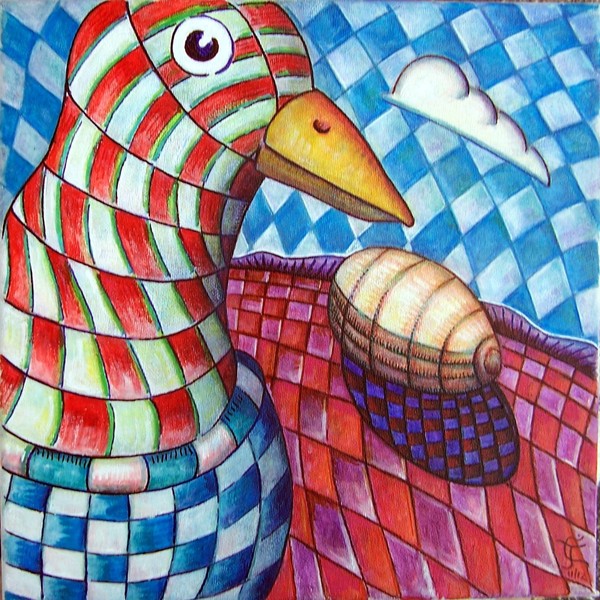
Locate an element on the screen. The width and height of the screenshot is (600, 600). digital artwork is located at coordinates click(23, 50).